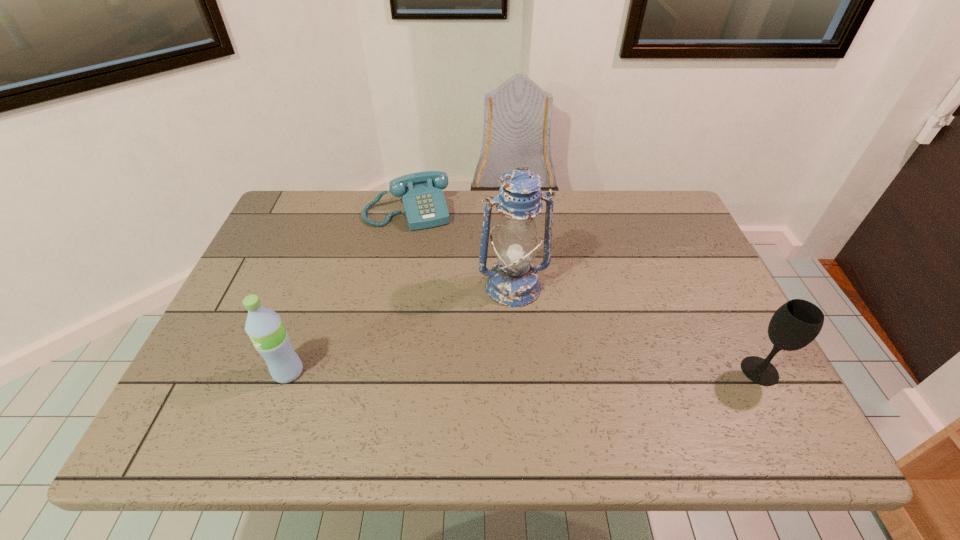
Locate an element on the screen. The image size is (960, 540). the second tallest object is located at coordinates (270, 338).

Where is `water bottle`? Image resolution: width=960 pixels, height=540 pixels. water bottle is located at coordinates 270,338.

The image size is (960, 540). I want to click on the rightmost object, so click(x=795, y=324).

I want to click on the third tallest object, so click(795, 324).

This screenshot has height=540, width=960. I want to click on the second object from left to right, so pos(422,196).

This screenshot has width=960, height=540. I want to click on telephone, so click(422, 196).

Where is `the tallest object`? the tallest object is located at coordinates (513, 281).

Where is `lantern`? Image resolution: width=960 pixels, height=540 pixels. lantern is located at coordinates (513, 281).

Where is `vacant space located 0.060m on the right of the leftmost object`? vacant space located 0.060m on the right of the leftmost object is located at coordinates (331, 372).

Where is `vacant space positioned 0.210m on the left of the second shortest object`? This screenshot has height=540, width=960. vacant space positioned 0.210m on the left of the second shortest object is located at coordinates (646, 371).